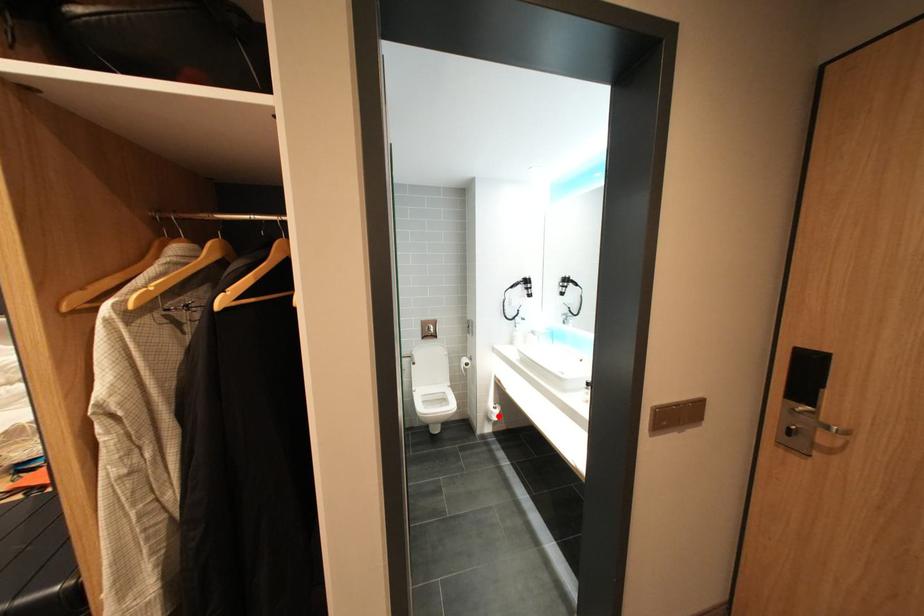
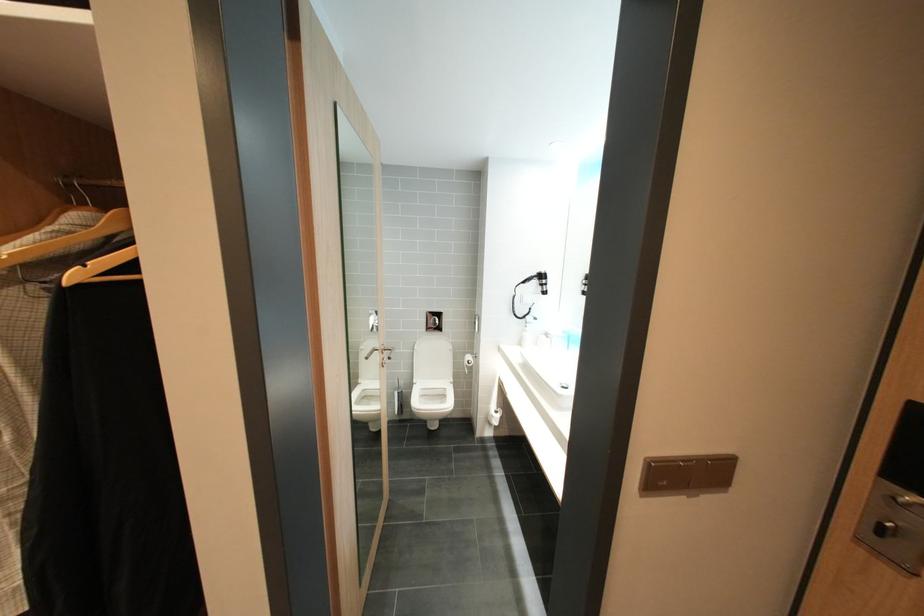
In the second image, find the point that corresponds to the highlighted location in the first image.

(499, 419)